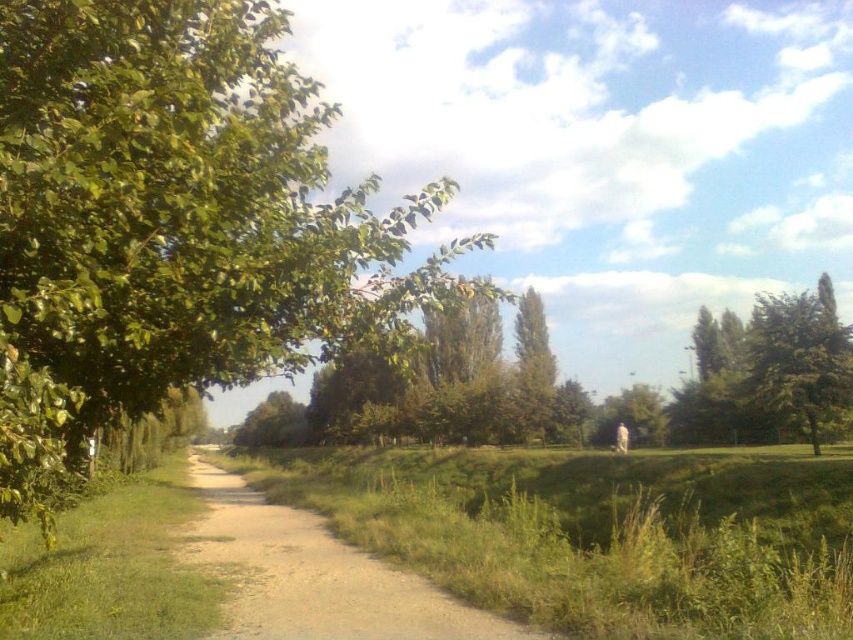
You are standing at the point labeled as point [596,532] in the image. Looking around, what type of terrain or surface are you currently standing on?

→ The point [596,532] is on green grass at lower center, so you are standing on green grass.